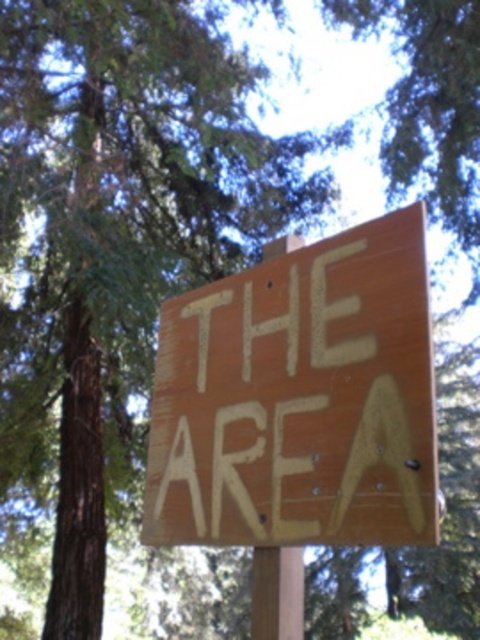
Which is behind, point (344, 497) or point (296, 554)?

Positioned behind is point (296, 554).

This screenshot has height=640, width=480. Find the location of `wooden sign at center`. wooden sign at center is located at coordinates (299, 400).